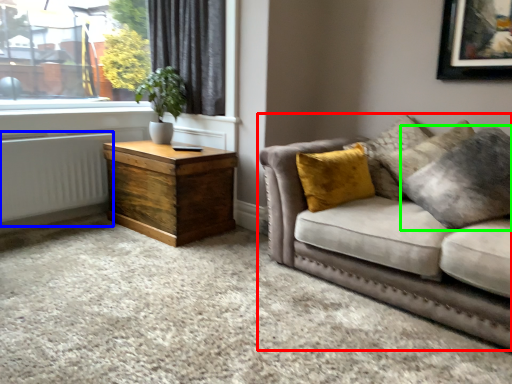
Question: Considering the real-world distances, which object is closest to studio couch (highlighted by a red box)? radiator (highlighted by a blue box) or pillow (highlighted by a green box).

Choices:
 (A) radiator
 (B) pillow

Answer: (B)